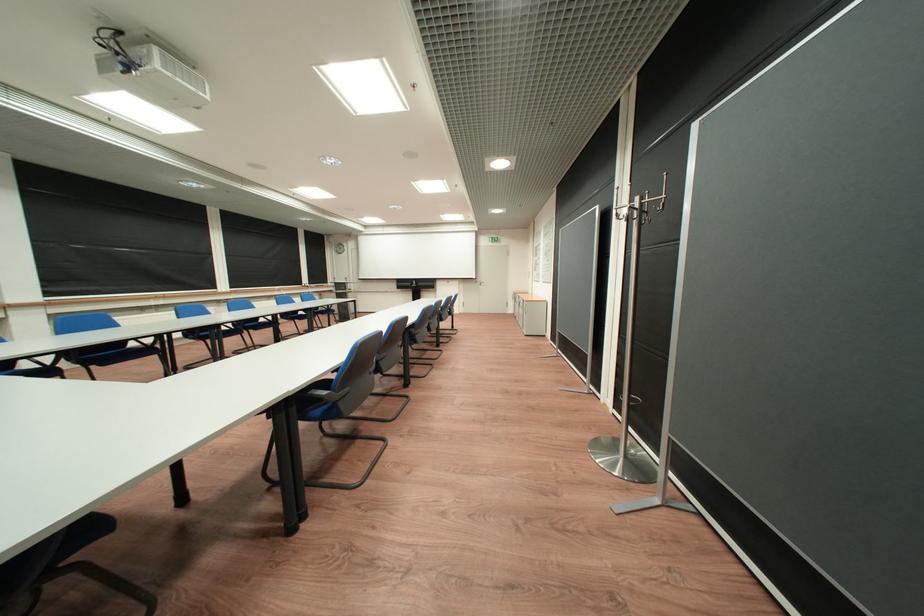
Find where to hang the metal coat hooks. Please return your answer as a coordinate pair (x, y).

(641, 208)